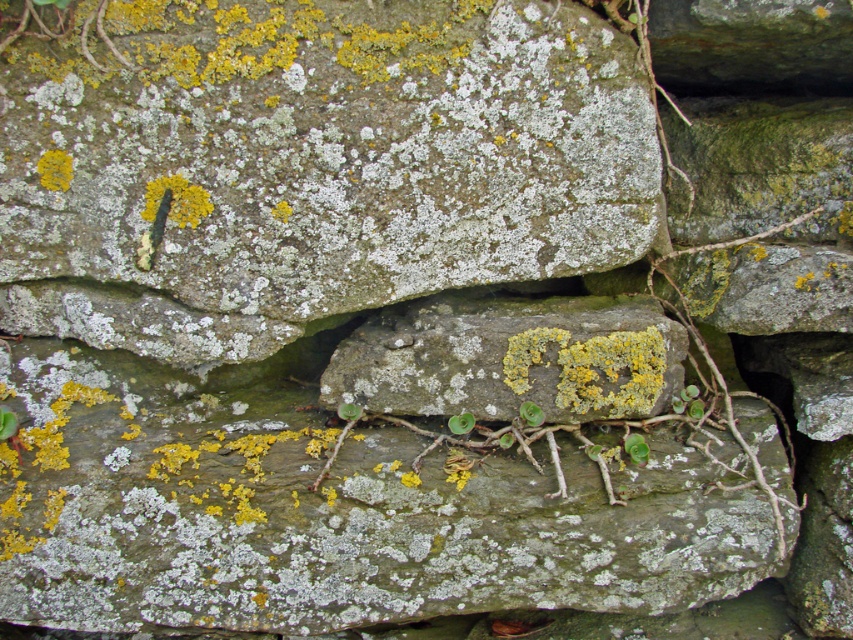
You are a gardener looking at the stone wall and notice two plants growing from it. Which one is positioned to the right of the other? The plants are the green succulent at center and the green leafy plant at center.

The green succulent at center is to the right of the green leafy plant at center.

You are standing at the point marked by the camera and want to place a small flag exactly at the point labeled point (x=363, y=390). If you walk straight ahead, will you reach the point before or after walking 4.29 feet?

The point labeled point (x=363, y=390) is 4.29 feet away from the camera. Therefore, if you walk straight ahead, you will reach the point exactly after walking 4.29 feet.